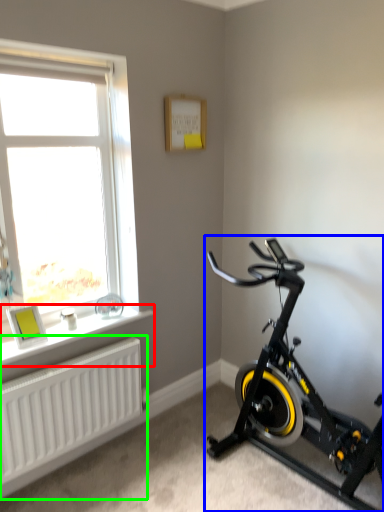
Question: Which object is positioned closest to window sill (highlighted by a red box)? Select from stationary bicycle (highlighted by a blue box) and radiator (highlighted by a green box).

Choices:
 (A) stationary bicycle
 (B) radiator

Answer: (B)